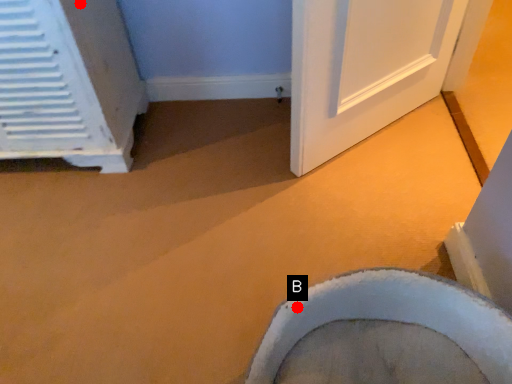
Question: Two points are circled on the image, labeled by A and B beside each circle. Which point is farther from the camera taking this photo?

Choices:
 (A) A is further
 (B) B is further

Answer: (A)